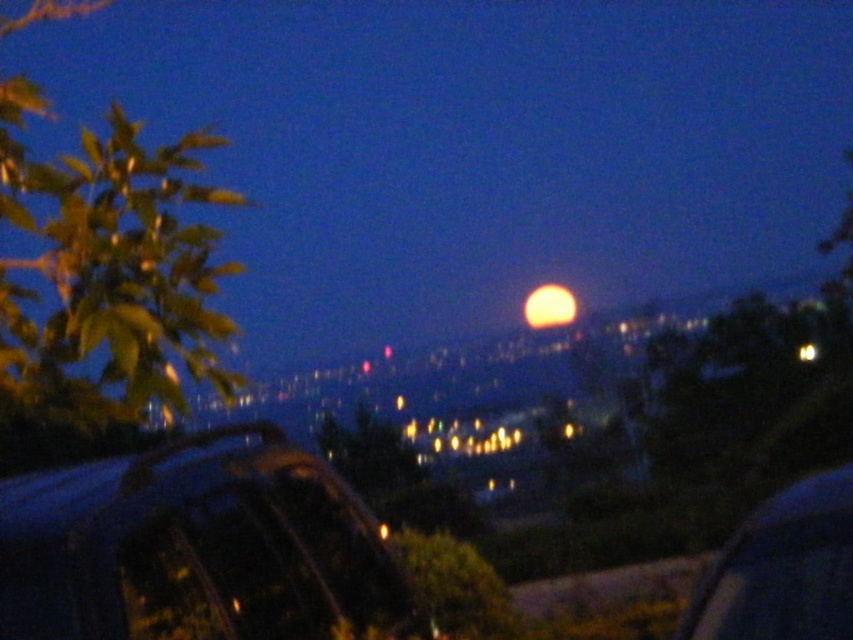
Question: Is green leafy tree at left closer to the viewer compared to yellow matte moon at center?

Choices:
 (A) no
 (B) yes

Answer: (B)

Question: Is metallic blue car at lower right behind green leafy tree at center?

Choices:
 (A) no
 (B) yes

Answer: (A)

Question: Estimate the real-world distances between objects in this image. Which object is closer to the yellow matte moon at center?

Choices:
 (A) green leafy tree at left
 (B) metallic blue car at lower right
 (C) green leafy tree at center
 (D) shiny black car at lower left

Answer: (A)

Question: Among these points, which one is farthest from the camera?

Choices:
 (A) (107, 401)
 (B) (802, 541)
 (C) (508, 632)
 (D) (47, 561)

Answer: (C)

Question: Is green leafy tree at left bigger than metallic blue car at lower right?

Choices:
 (A) yes
 (B) no

Answer: (A)

Question: Estimate the real-world distances between objects in this image. Which object is farther from the metallic blue car at lower right?

Choices:
 (A) green leafy tree at left
 (B) green leafy tree at center

Answer: (A)